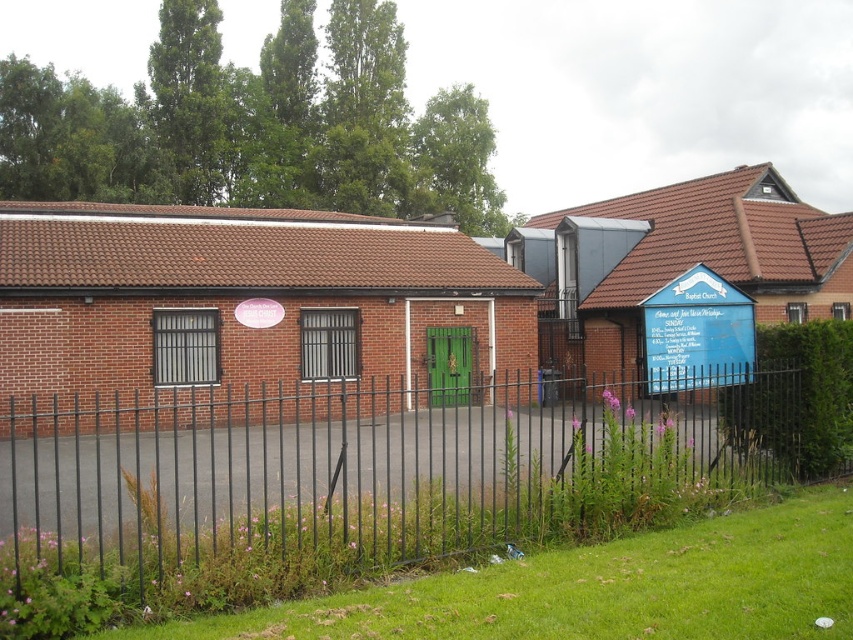
Which of these two, black metal fence at center or blue painted wooden sign at right, stands shorter?

blue painted wooden sign at right is shorter.

Is black metal fence at center above blue painted wooden sign at right?

No.

Does point (701, 416) come in front of point (735, 336)?

That is False.

I want to click on black metal fence at center, so click(361, 476).